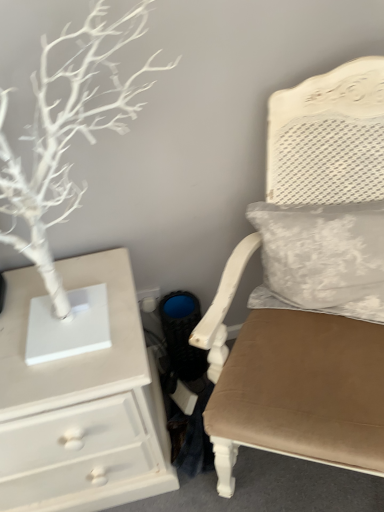
Describe the element at coordinates (67, 133) in the screenshot. I see `white matte tree at left` at that location.

The image size is (384, 512). Describe the element at coordinates (322, 258) in the screenshot. I see `white textured pillow at upper right` at that location.

Measure the distance between point (356,93) and camera.

36.06 inches.

Where is `white matte tree at left`? white matte tree at left is located at coordinates (67, 133).

Can you tell me how much white matte tree at left and white textured pillow at upper right differ in facing direction?

The facing directions of white matte tree at left and white textured pillow at upper right are 25 degrees apart.

The height and width of the screenshot is (512, 384). I want to click on tree on the left of the white textured pillow at upper right, so click(x=67, y=133).

Is white matte tree at left situated inside white textured pillow at upper right or outside?

white matte tree at left is not inside white textured pillow at upper right, it's outside.

Is point (104, 30) more distant than point (278, 216)?

That is False.

From the image's perspective, is velvet beige chair at center above or below white matte tree at left?

velvet beige chair at center is below white matte tree at left.

From the picture: Is velvet beige chair at center situated inside white matte tree at left or outside?

velvet beige chair at center lies outside white matte tree at left.

Can you confirm if velvet beige chair at center is taller than white matte tree at left?

Indeed, velvet beige chair at center has a greater height compared to white matte tree at left.

How different are the orientations of velvet beige chair at center and white matte tree at left in degrees?

The angular difference between velvet beige chair at center and white matte tree at left is 27.8 degrees.

Is the depth of velvet beige chair at center less than that of white painted wood chest of drawers at left?

That is True.

Looking at this image, from the image's perspective, is velvet beige chair at center on top of white painted wood chest of drawers at left?

Yes.

Is velvet beige chair at center facing away from white painted wood chest of drawers at left?

velvet beige chair at center does not have its back to white painted wood chest of drawers at left.

Locate an element on the screen. chair that is above the white painted wood chest of drawers at left (from a real-world perspective) is located at coordinates (292, 383).

From the image's perspective, which one is positioned lower, white painted wood chest of drawers at left or white matte tree at left?

From the image's view, white painted wood chest of drawers at left is below.

At what (x,y) coordinates should I click in order to perform the action: click on chest of drawers on the left of the white matte tree at left. Please return your answer as a coordinate pair (x, y). Looking at the image, I should click on (81, 403).

Which is correct: white painted wood chest of drawers at left is inside white matte tree at left, or outside of it?

white painted wood chest of drawers at left exists outside the volume of white matte tree at left.

Can you see white painted wood chest of drawers at left touching white matte tree at left?

No, white painted wood chest of drawers at left is not beside white matte tree at left.

Which of these two, white painted wood chest of drawers at left or velvet beige chair at center, stands shorter?

Standing shorter between the two is white painted wood chest of drawers at left.

Is white painted wood chest of drawers at left positioned with its back to velvet beige chair at center?

No, white painted wood chest of drawers at left's orientation is not away from velvet beige chair at center.

In the scene shown: Is white painted wood chest of drawers at left with velvet beige chair at center?

There is a gap between white painted wood chest of drawers at left and velvet beige chair at center.

Based on the photo, considering the relative positions of white painted wood chest of drawers at left and velvet beige chair at center in the image provided, is white painted wood chest of drawers at left in front of velvet beige chair at center?

No, it is behind velvet beige chair at center.

From the picture: Is velvet beige chair at center smaller than white textured pillow at upper right?

No.

Does velvet beige chair at center have a lesser width compared to white textured pillow at upper right?

Incorrect, the width of velvet beige chair at center is not less than that of white textured pillow at upper right.

Is velvet beige chair at center completely or partially outside of white textured pillow at upper right?

Yes, velvet beige chair at center is not within white textured pillow at upper right.

From the image's perspective, is white matte tree at left on velvet beige chair at center?

Correct, white matte tree at left appears higher than velvet beige chair at center in the image.

In terms of width, does white matte tree at left look wider or thinner when compared to velvet beige chair at center?

Clearly, white matte tree at left has less width compared to velvet beige chair at center.

Considering the sizes of objects white matte tree at left and velvet beige chair at center in the image provided, who is taller, white matte tree at left or velvet beige chair at center?

With more height is velvet beige chair at center.

Which is behind, point (69, 106) or point (374, 152)?

Positioned behind is point (374, 152).

Identify the location of tree that appears in front of the white textured pillow at upper right. Image resolution: width=384 pixels, height=512 pixels. (67, 133).

Locate an element on the screen. The image size is (384, 512). chair below the white matte tree at left (from the image's perspective) is located at coordinates (292, 383).

Considering their positions, is white matte tree at left positioned closer to white textured pillow at upper right than white painted wood chest of drawers at left?

white painted wood chest of drawers at left is positioned closer to the anchor white textured pillow at upper right.

Estimate the real-world distances between objects in this image. Which object is closer to white painted wood chest of drawers at left, white textured pillow at upper right or white matte tree at left?

white matte tree at left is positioned closer to the anchor white painted wood chest of drawers at left.

Estimate the real-world distances between objects in this image. Which object is further from white matte tree at left, white painted wood chest of drawers at left or white textured pillow at upper right?

white textured pillow at upper right lies further to white matte tree at left than the other object.

Based on their spatial positions, is white matte tree at left or velvet beige chair at center further from white painted wood chest of drawers at left?

white matte tree at left is positioned further to the anchor white painted wood chest of drawers at left.

Looking at the image, which one is located further to white matte tree at left, velvet beige chair at center or white textured pillow at upper right?

white textured pillow at upper right lies further to white matte tree at left than the other object.

Which object lies nearer to the anchor point white matte tree at left, white textured pillow at upper right or velvet beige chair at center?

velvet beige chair at center.

Estimate the real-world distances between objects in this image. Which object is further from white painted wood chest of drawers at left, velvet beige chair at center or white matte tree at left?

Based on the image, white matte tree at left appears to be further to white painted wood chest of drawers at left.

Looking at the image, which one is located further to white painted wood chest of drawers at left, white textured pillow at upper right or velvet beige chair at center?

Based on the image, white textured pillow at upper right appears to be further to white painted wood chest of drawers at left.

I want to click on chair between white painted wood chest of drawers at left and white textured pillow at upper right, so click(x=292, y=383).

This screenshot has height=512, width=384. Find the location of `tree between white painted wood chest of drawers at left and white textured pillow at upper right`. tree between white painted wood chest of drawers at left and white textured pillow at upper right is located at coordinates (67, 133).

You are a GUI agent. You are given a task and a screenshot of the screen. Output one action in this format:
    pyautogui.click(x=<x>, y=<y>)
    Task: Click on the chair between white matte tree at left and white textured pillow at upper right in the horizontal direction
    This screenshot has width=384, height=512.
    Given the screenshot: What is the action you would take?
    pyautogui.click(x=292, y=383)

Where is `tree situated between white painted wood chest of drawers at left and velvet beige chair at center from left to right`? The image size is (384, 512). tree situated between white painted wood chest of drawers at left and velvet beige chair at center from left to right is located at coordinates (67, 133).